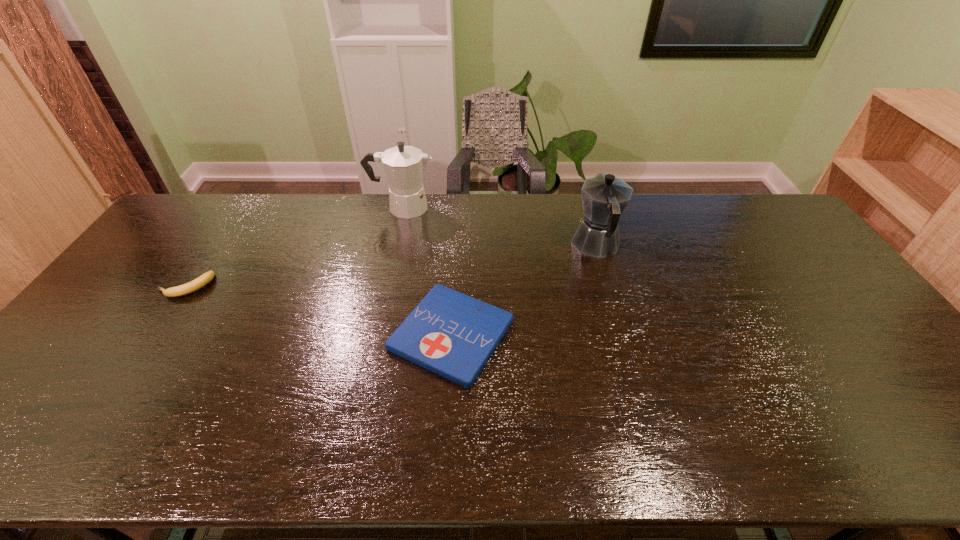
This screenshot has height=540, width=960. I want to click on vacant space that's between the leftmost object and the nearer coffeepot, so click(391, 266).

You are a GUI agent. You are given a task and a screenshot of the screen. Output one action in this format:
    pyautogui.click(x=<x>, y=<y>)
    Task: Click on the free spot between the banana and the second farthest object
    
    Given the screenshot: What is the action you would take?
    pyautogui.click(x=391, y=266)

Image resolution: width=960 pixels, height=540 pixels. In order to click on free space between the farthest object and the first-aid kit in this screenshot , I will do click(427, 271).

Where is `free space between the farthest object and the rightmost object`? The width and height of the screenshot is (960, 540). free space between the farthest object and the rightmost object is located at coordinates (499, 226).

Find the location of `unoccupied area between the leftmost object and the first-aid kit`. unoccupied area between the leftmost object and the first-aid kit is located at coordinates (319, 310).

Image resolution: width=960 pixels, height=540 pixels. What are the coordinates of `vacant space in between the leftmost object and the second farthest object` in the screenshot? It's located at (391, 266).

Where is `object that stands as the closest to the shortest object`? The image size is (960, 540). object that stands as the closest to the shortest object is located at coordinates (x=604, y=197).

This screenshot has height=540, width=960. In order to click on object that is the second closest to the rightmost object in this screenshot , I will do `click(404, 165)`.

At what (x,y) coordinates should I click in order to perform the action: click on vacant space that satisfies the following two spatial constraints: 1. on the back side of the shortest object; 2. at the spout of the farther coffeepot. Please return your answer as a coordinate pair (x, y). Looking at the image, I should click on (459, 207).

I want to click on vacant space that satisfies the following two spatial constraints: 1. at the spout of the left coffeepot; 2. at the spout of the rightmost object, so click(395, 245).